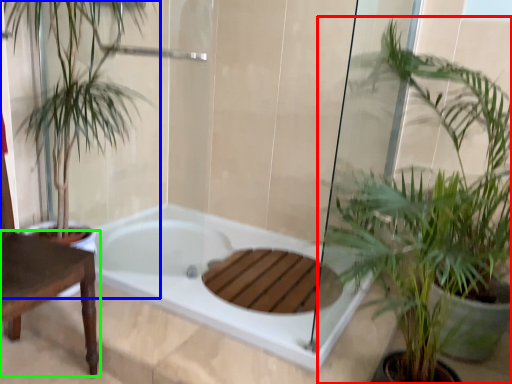
Question: Based on their relative distances, which object is farther from houseplant (highlighted by a red box)? Choose from houseplant (highlighted by a blue box) and table (highlighted by a green box).

Choices:
 (A) houseplant
 (B) table

Answer: (A)